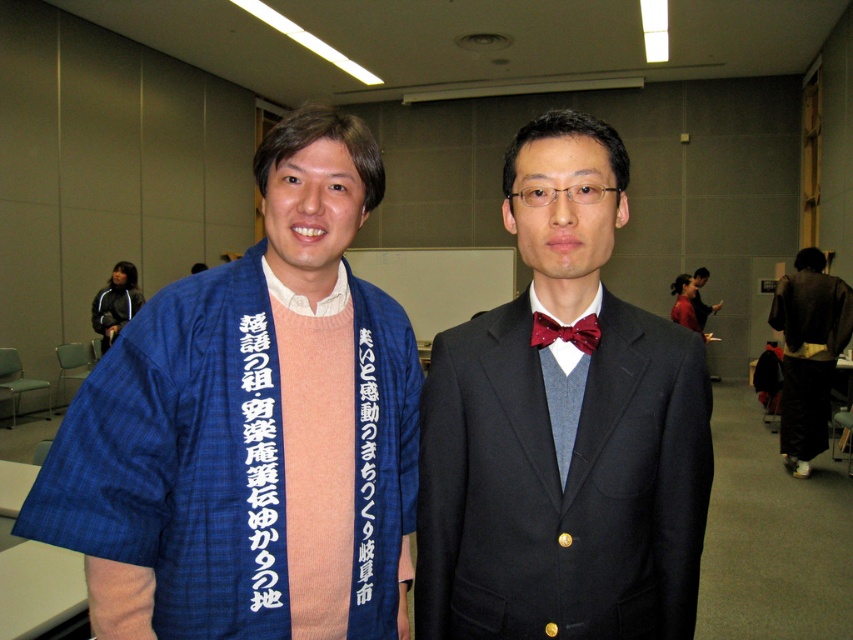
You are organizing a photo shoot and need to position the brown kimono at right and the dark gray suit at center so that they are visible in the frame. Based on their current positions, which object is closer to the bottom of the image?

The brown kimono at right is located below the dark gray suit at center, so it is closer to the bottom of the image.

You are standing in a conference room and need to place two markers on the whiteboard. The first marker should be placed at point (579, 339) and the second at point (714, 308). Which point will appear closer to you when viewed from your current position?

Point (579, 339) is closer to the viewer than point (714, 308), so the first marker placed at point (579, 339) will appear closer to you.

You are organizing a formal event and need to ensure all accessories are visible from a distance. Given the image, which object between the shiny red bow tie at center and the dark gray suit at center would be harder to see from afar due to its size?

The shiny red bow tie at center has a smaller width compared to the dark gray suit at center, making it harder to see from a distance.